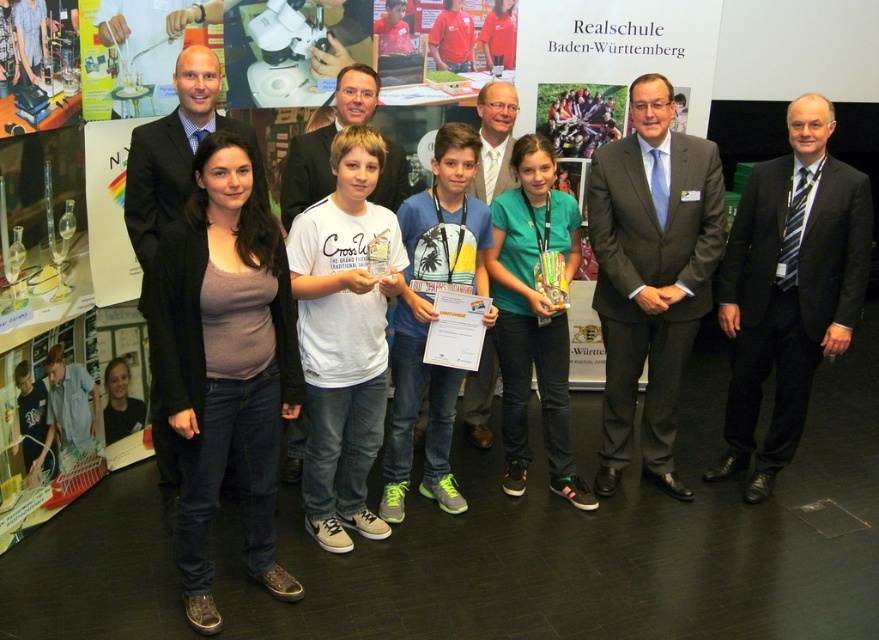
Does black suit at right appear on the right side of matte black suit at left?

Correct, you'll find black suit at right to the right of matte black suit at left.

Who is lower down, black suit at right or matte black suit at left?

black suit at right is below.

This screenshot has width=879, height=640. What do you see at coordinates (789, 288) in the screenshot?
I see `black suit at right` at bounding box center [789, 288].

Locate an element on the screen. black suit at right is located at coordinates click(x=789, y=288).

Which is below, black suit at right or white cotton t-shirt at center?

black suit at right

I want to click on black suit at right, so click(x=789, y=288).

In order to click on black suit at right in this screenshot , I will do `click(789, 288)`.

Which is more to the right, black suit at right or matte gray suit at center?

From the viewer's perspective, black suit at right appears more on the right side.

Between black suit at right and matte gray suit at center, which one appears on the left side from the viewer's perspective?

Positioned to the left is matte gray suit at center.

The height and width of the screenshot is (640, 879). I want to click on black suit at right, so click(x=789, y=288).

At what (x,y) coordinates should I click in order to perform the action: click on black suit at right. Please return your answer as a coordinate pair (x, y). The height and width of the screenshot is (640, 879). Looking at the image, I should click on (789, 288).